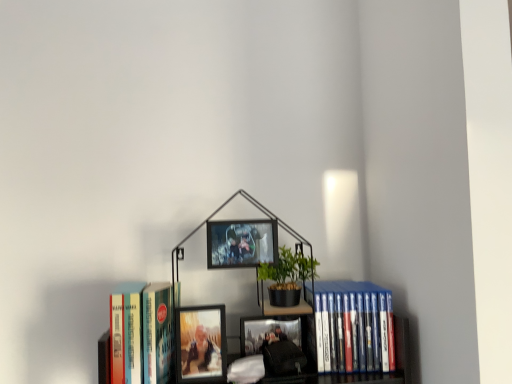
Question: Is hardcover book at left, placed as the second book when sorted from right to left, bigger than metallic silver picture frame at center, which is the 1th picture frame from top to bottom?

Choices:
 (A) yes
 (B) no

Answer: (A)

Question: Is hardcover book at left, marked as the 1th book in a left-to-right arrangement, oriented away from metallic silver picture frame at center, marked as the 2th picture frame in a bottom-to-top arrangement?

Choices:
 (A) no
 (B) yes

Answer: (A)

Question: Could you tell me if hardcover book at left, placed as the second book when sorted from right to left, is turned towards metallic silver picture frame at center, which is the 1th picture frame from top to bottom?

Choices:
 (A) yes
 (B) no

Answer: (B)

Question: From a real-world perspective, is hardcover book at left, placed as the second book when sorted from right to left, on metallic silver picture frame at center, which is the 1th picture frame from top to bottom?

Choices:
 (A) no
 (B) yes

Answer: (A)

Question: Is the depth of hardcover book at left, placed as the second book when sorted from right to left, less than that of metallic silver picture frame at center, marked as the 2th picture frame in a bottom-to-top arrangement?

Choices:
 (A) yes
 (B) no

Answer: (A)

Question: From a real-world perspective, is hardcover book at left, placed as the second book when sorted from right to left, physically located above or below matte glass photo frame at center, the 2th picture frame in the top-to-bottom sequence?

Choices:
 (A) below
 (B) above

Answer: (B)

Question: Do you think hardcover book at left, marked as the 1th book in a left-to-right arrangement, is within matte glass photo frame at center, the 2th picture frame in the top-to-bottom sequence, or outside of it?

Choices:
 (A) inside
 (B) outside

Answer: (B)

Question: Is hardcover book at left, placed as the second book when sorted from right to left, taller or shorter than matte glass photo frame at center, the 2th picture frame in the top-to-bottom sequence?

Choices:
 (A) tall
 (B) short

Answer: (A)

Question: Based on their sizes in the image, would you say hardcover book at left, placed as the second book when sorted from right to left, is bigger or smaller than matte glass photo frame at center, which ranks as the first picture frame in bottom-to-top order?

Choices:
 (A) small
 (B) big

Answer: (B)

Question: From their relative heights in the image, would you say hardcover book at left, marked as the 1th book in a left-to-right arrangement, is taller or shorter than metallic silver picture frame at center, which is the 1th picture frame from top to bottom?

Choices:
 (A) tall
 (B) short

Answer: (A)

Question: Is point (133, 306) positioned closer to the camera than point (266, 259)?

Choices:
 (A) farther
 (B) closer

Answer: (B)

Question: Is hardcover book at left, marked as the 1th book in a left-to-right arrangement, to the left or to the right of metallic silver picture frame at center, marked as the 2th picture frame in a bottom-to-top arrangement, in the image?

Choices:
 (A) left
 (B) right

Answer: (A)

Question: Considering the positions of hardcover book at left, placed as the second book when sorted from right to left, and metallic silver picture frame at center, which is the 1th picture frame from top to bottom, in the image, is hardcover book at left, placed as the second book when sorted from right to left, wider or thinner than metallic silver picture frame at center, which is the 1th picture frame from top to bottom,?

Choices:
 (A) wide
 (B) thin

Answer: (A)

Question: From the image's perspective, relative to blue plastic dvds at right, the first book in the right-to-left sequence, is metallic silver picture frame at center, which is the 1th picture frame from top to bottom, above or below?

Choices:
 (A) above
 (B) below

Answer: (A)

Question: Is metallic silver picture frame at center, marked as the 2th picture frame in a bottom-to-top arrangement, inside or outside of blue plastic dvds at right, the first book in the right-to-left sequence?

Choices:
 (A) outside
 (B) inside

Answer: (A)